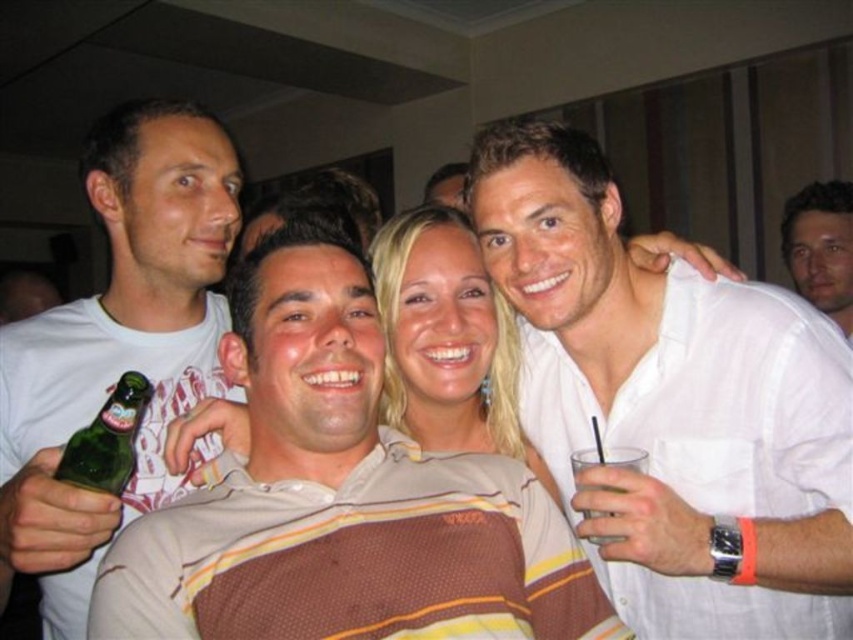
Question: Which is farther from the blonde hair at center?

Choices:
 (A) clear plastic cup at upper right
 (B) matte white shirt at upper right

Answer: (B)

Question: Can you confirm if matte white shirt at upper right is positioned to the left of green glass bottle at lower left?

Choices:
 (A) no
 (B) yes

Answer: (A)

Question: Among these objects, which one is nearest to the camera?

Choices:
 (A) white matte t-shirt at left
 (B) green glass bottle at lower left
 (C) blonde hair at center

Answer: (A)

Question: Is white matte t-shirt at left below matte white shirt at upper right?

Choices:
 (A) yes
 (B) no

Answer: (A)

Question: Does matte white shirt at upper right appear under green glass bottle at lower left?

Choices:
 (A) yes
 (B) no

Answer: (B)

Question: Which of the following is the farthest from the observer?

Choices:
 (A) (144, 120)
 (B) (727, 285)
 (C) (577, 474)

Answer: (A)